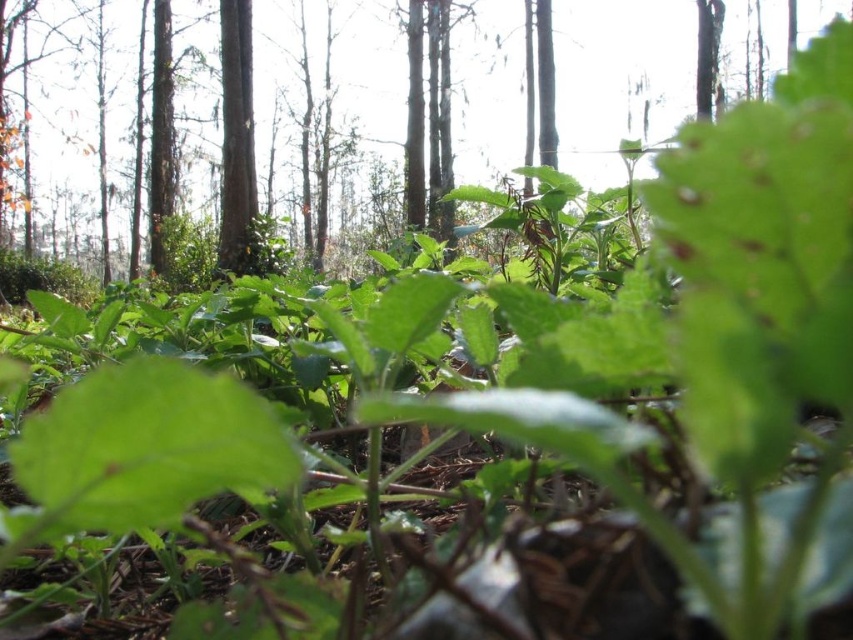
Does green leafy plant at center come in front of smooth brown tree trunk at upper center?

Yes, it is.

In the scene shown: Who is shorter, green leafy plant at center or smooth brown tree trunk at upper center?

smooth brown tree trunk at upper center

Which is behind, point (454, 97) or point (219, 61)?

The point (454, 97) is behind.

Locate an element on the screen. green leafy plant at center is located at coordinates (619, 77).